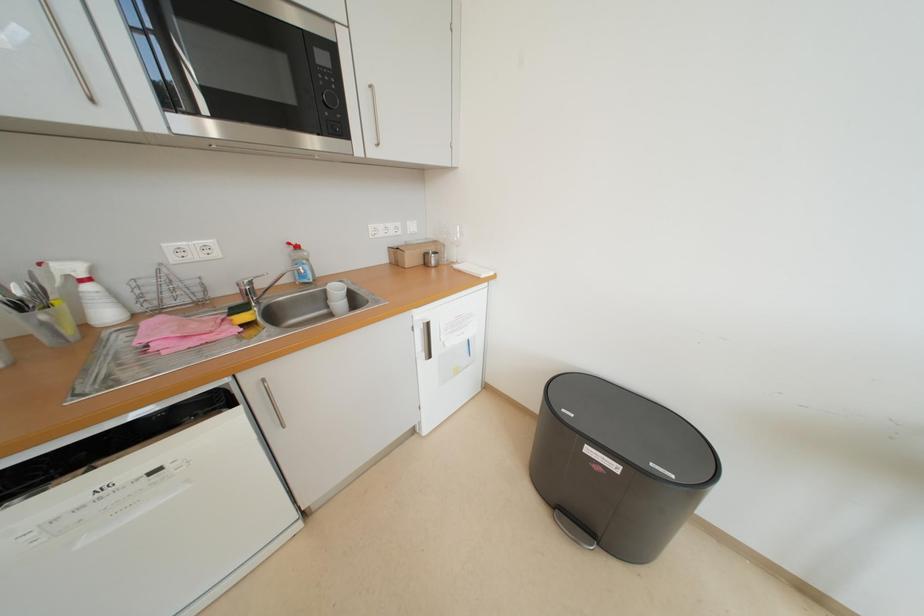
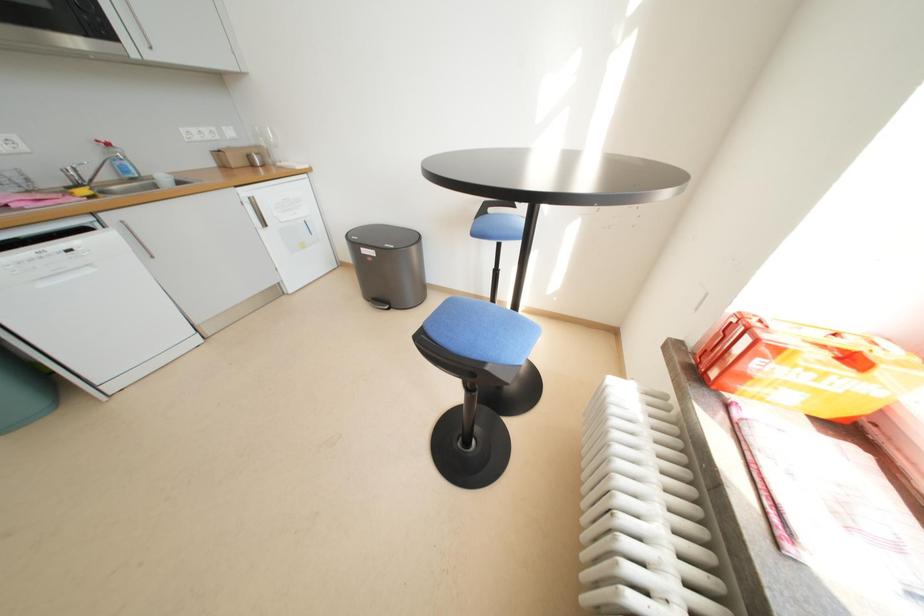
What movement of the cameraman would produce the second image?

The cameraman walked toward right, backward.